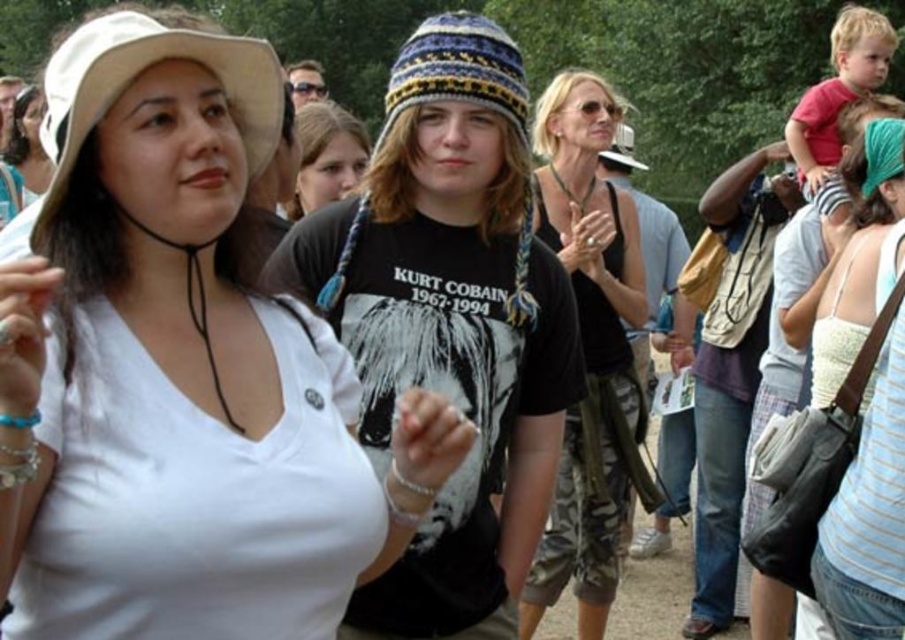
Which is below, black matte tank top at center or white striped tank top at center?

black matte tank top at center is lower down.

Is black matte tank top at center taller than white striped tank top at center?

Incorrect, black matte tank top at center's height is not larger of white striped tank top at center's.

Which is in front, point (564, 483) or point (875, 468)?

Point (875, 468) is in front.

The height and width of the screenshot is (640, 905). I want to click on black matte tank top at center, so click(x=589, y=349).

Is white matte shirt at center below knitted woolen beanie at center?

Yes, white matte shirt at center is below knitted woolen beanie at center.

Can you confirm if white matte shirt at center is thinner than knitted woolen beanie at center?

Yes, white matte shirt at center is thinner than knitted woolen beanie at center.

What do you see at coordinates (176, 244) in the screenshot? I see `white matte shirt at center` at bounding box center [176, 244].

Identify the location of white matte shirt at center. (176, 244).

Between red cotton shirt at upper right and matte white shirt at upper left, which one is positioned higher?

Positioned higher is red cotton shirt at upper right.

Is red cotton shirt at upper right bigger than matte white shirt at upper left?

Yes, red cotton shirt at upper right is bigger than matte white shirt at upper left.

Where is `red cotton shirt at upper right`? Image resolution: width=905 pixels, height=640 pixels. red cotton shirt at upper right is located at coordinates (837, 90).